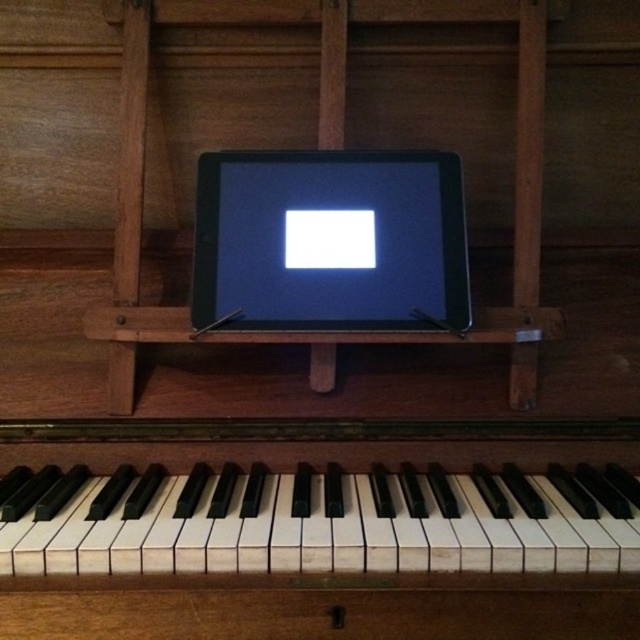
Question: Is white matte piano keys at center to the left of black glossy tablet at center from the viewer's perspective?

Choices:
 (A) no
 (B) yes

Answer: (B)

Question: Among these points, which one is farthest from the camera?

Choices:
 (A) (349, 177)
 (B) (356, 442)

Answer: (B)

Question: Is white matte piano keys at center bigger than black glossy tablet at center?

Choices:
 (A) no
 (B) yes

Answer: (B)

Question: Does white matte piano keys at center have a greater width compared to black glossy tablet at center?

Choices:
 (A) yes
 (B) no

Answer: (A)

Question: Which object is closer to the camera taking this photo?

Choices:
 (A) white matte piano keys at center
 (B) black glossy tablet at center

Answer: (A)

Question: Which of the following is the farthest from the observer?

Choices:
 (A) (296, 189)
 (B) (538, 528)

Answer: (A)